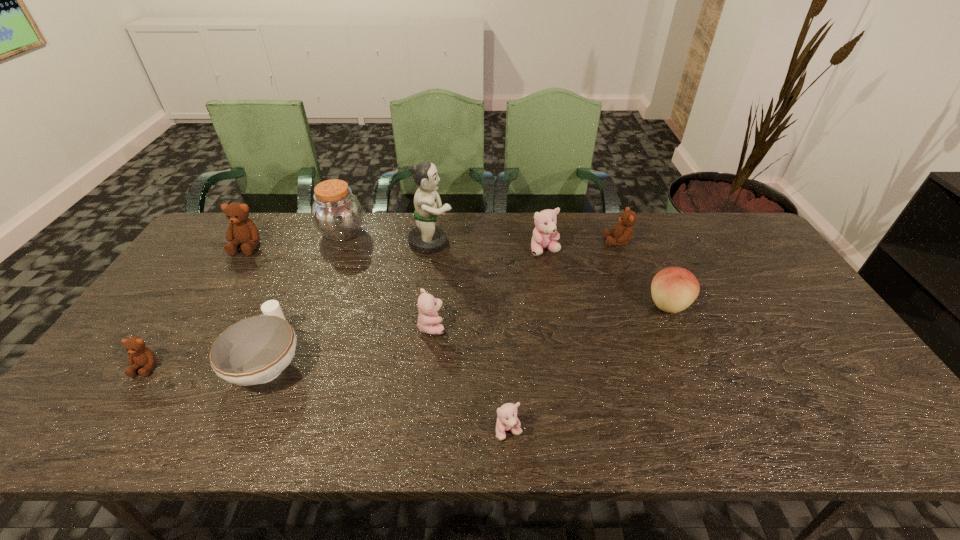
Identify the location of free space between the peach and the leftmost pink teddy bear. (550, 315).

You are a GUI agent. You are given a task and a screenshot of the screen. Output one action in this format:
    pyautogui.click(x=<x>, y=<y>)
    Task: Click on the free space between the peach and the seventh object from left to right
    Image resolution: width=960 pixels, height=540 pixels.
    Given the screenshot: What is the action you would take?
    pyautogui.click(x=588, y=368)

This screenshot has width=960, height=540. What are the coordinates of `vacant space that's between the peach and the fifth teddy bear from left to right` in the screenshot? It's located at (607, 277).

Find the location of a particular element. empty space between the second smallest pink teddy bear and the nearest teddy bear is located at coordinates (470, 379).

At what (x,y) coordinates should I click in order to perform the action: click on free space between the chinaware and the rightmost teddy bear. Please return your answer as a coordinate pair (x, y). Looking at the image, I should click on (444, 301).

This screenshot has width=960, height=540. What are the coordinates of `free space between the peach and the rightmost teddy bear` in the screenshot? It's located at (643, 273).

Locate an element on the screen. This screenshot has width=960, height=540. vacant area that lies between the second teddy bear from right to left and the biggest brown teddy bear is located at coordinates (396, 248).

At what (x,y) coordinates should I click in order to perform the action: click on vacant space that is in between the rightmost teddy bear and the nearest teddy bear. Please return your answer as a coordinate pair (x, y). This screenshot has width=960, height=540. Looking at the image, I should click on (564, 336).

Locate which object ranks ninth in proximity to the brown jar. Please provide its 2D coordinates. Your answer should be formatted as a tuple, i.e. [(x, y)], where the tuple contains the x and y coordinates of a point satisfying the conditions above.

[(673, 289)]

Identify which object is located as the ninth nearest to the figurine. Please provide its 2D coordinates. Your answer should be formatted as a tuple, i.e. [(x, y)], where the tuple contains the x and y coordinates of a point satisfying the conditions above.

[(140, 356)]